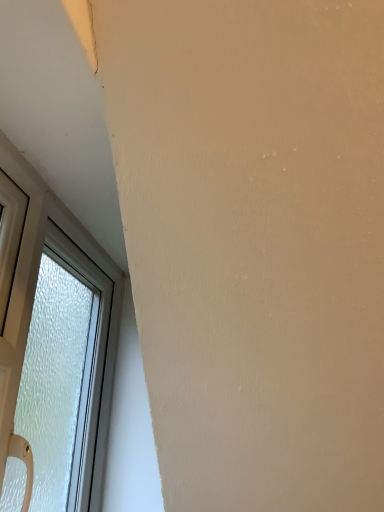
What do you see at coordinates (31, 312) in the screenshot? The width and height of the screenshot is (384, 512). I see `clear glass window at left` at bounding box center [31, 312].

Locate an element on the screen. The height and width of the screenshot is (512, 384). clear glass window at left is located at coordinates (31, 312).

Find the location of a particular element. clear glass window at left is located at coordinates (31, 312).